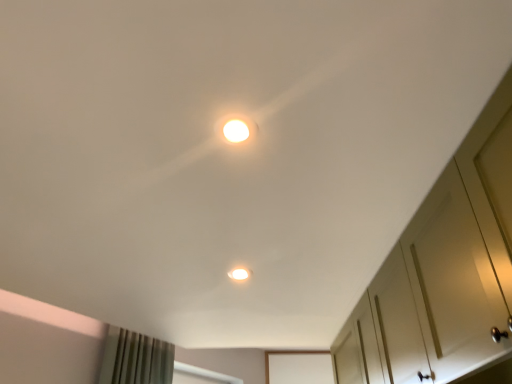
Question: Is the position of white matte cabinet at right more distant than that of white glossy light fixture at upper center, the first dot when ordered from top to bottom?

Choices:
 (A) no
 (B) yes

Answer: (A)

Question: Are white matte cabinet at right and white glossy light fixture at upper center, the first dot viewed from the front, located far from each other?

Choices:
 (A) no
 (B) yes

Answer: (A)

Question: From the image's perspective, is white matte cabinet at right on white glossy light fixture at upper center, the second dot from the back?

Choices:
 (A) no
 (B) yes

Answer: (A)

Question: Is white matte cabinet at right positioned before white glossy light fixture at upper center, the first dot when ordered from top to bottom?

Choices:
 (A) no
 (B) yes

Answer: (B)

Question: Is white matte cabinet at right shorter than white glossy light fixture at upper center, positioned as the 2th dot in bottom-to-top order?

Choices:
 (A) yes
 (B) no

Answer: (B)

Question: Is white matte cabinet at right not within white glossy light fixture at upper center, the second dot from the back?

Choices:
 (A) yes
 (B) no

Answer: (A)

Question: Can you confirm if matte white light at center, marked as the first dot in a back-to-front arrangement, is taller than white matte cabinet at right?

Choices:
 (A) yes
 (B) no

Answer: (B)

Question: Is matte white light at center, the 2th dot in the front-to-back sequence, further to camera compared to white matte cabinet at right?

Choices:
 (A) no
 (B) yes

Answer: (B)

Question: Considering the relative sizes of matte white light at center, the 2th dot in the front-to-back sequence, and white matte cabinet at right in the image provided, is matte white light at center, the 2th dot in the front-to-back sequence, smaller than white matte cabinet at right?

Choices:
 (A) no
 (B) yes

Answer: (B)

Question: Is white matte cabinet at right a part of matte white light at center, marked as the 1th dot in a bottom-to-top arrangement?

Choices:
 (A) yes
 (B) no

Answer: (B)

Question: Is matte white light at center, marked as the 1th dot in a bottom-to-top arrangement, positioned before white matte cabinet at right?

Choices:
 (A) no
 (B) yes

Answer: (A)

Question: Is matte white light at center, marked as the first dot in a back-to-front arrangement, not inside white matte cabinet at right?

Choices:
 (A) no
 (B) yes

Answer: (B)

Question: Is white glossy light fixture at upper center, the second dot from the back, oriented towards matte white light at center, marked as the 1th dot in a bottom-to-top arrangement?

Choices:
 (A) no
 (B) yes

Answer: (A)